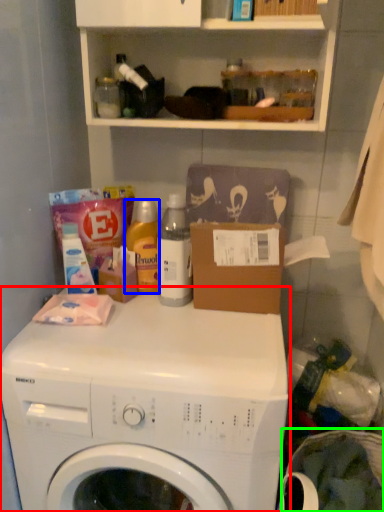
Question: Based on their relative distances, which object is farther from washing machine (highlighted by a red box)? Choose from cleaning product (highlighted by a blue box) and laundry basket (highlighted by a green box).

Choices:
 (A) cleaning product
 (B) laundry basket

Answer: (B)